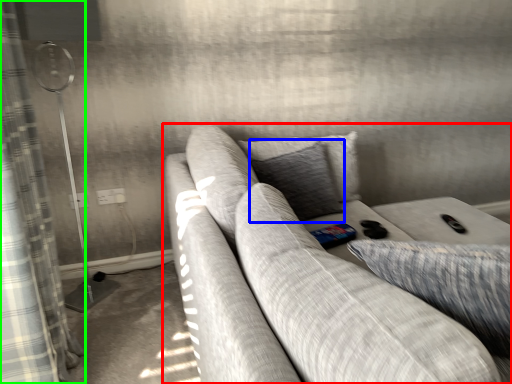
Question: Which object is positioned closest to studio couch (highlighted by a red box)? Select from pillow (highlighted by a blue box) and curtain (highlighted by a green box).

Choices:
 (A) pillow
 (B) curtain

Answer: (A)